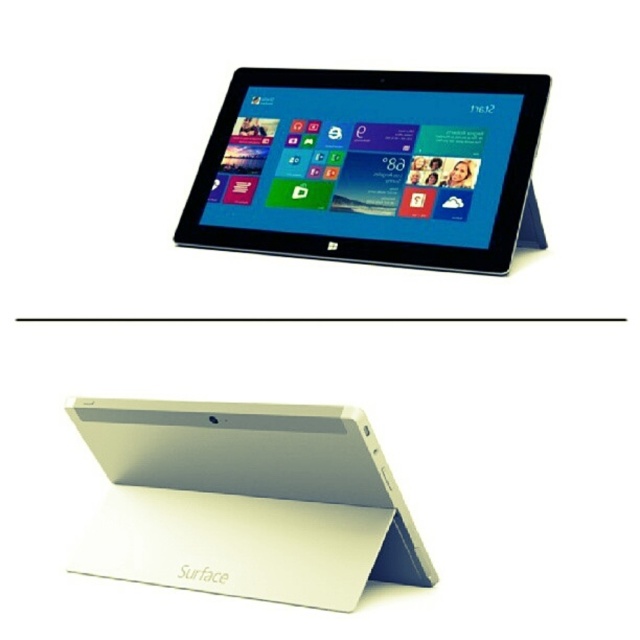
Question: Which point is closer to the camera taking this photo?

Choices:
 (A) (442, 225)
 (B) (317, 596)

Answer: (B)

Question: Does white matte tablet at upper center have a smaller size compared to white matte surface at upper center?

Choices:
 (A) yes
 (B) no

Answer: (B)

Question: Which point is farther to the camera?

Choices:
 (A) white matte tablet at upper center
 (B) white matte surface at upper center

Answer: (A)

Question: Is white matte tablet at upper center further to camera compared to white matte surface at upper center?

Choices:
 (A) no
 (B) yes

Answer: (B)

Question: Is white matte tablet at upper center thinner than white matte surface at upper center?

Choices:
 (A) no
 (B) yes

Answer: (A)